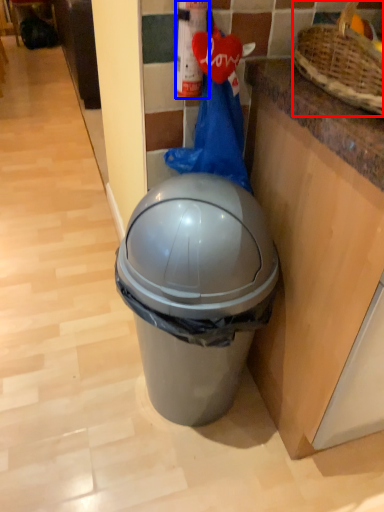
Question: Which of the following is the closest to the observer, basket (highlighted by a red box) or extinguisher (highlighted by a blue box)?

Choices:
 (A) basket
 (B) extinguisher

Answer: (A)